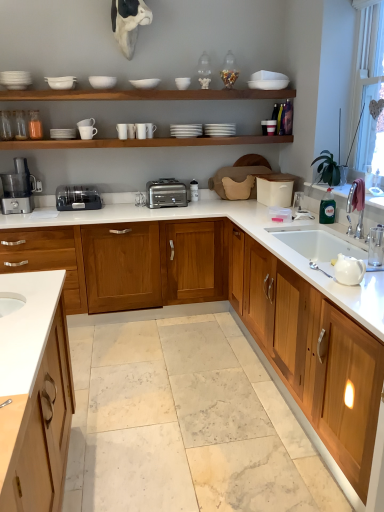
Question: In the image, is satin silver toaster at center, the 1th appliance when ordered from right to left, on the left side or the right side of satin silver toaster at center?

Choices:
 (A) right
 (B) left

Answer: (A)

Question: In the image, is satin silver toaster at center, which is the 2th appliance from front to back, positioned in front of or behind satin silver toaster at center?

Choices:
 (A) behind
 (B) front

Answer: (A)

Question: Which of these objects is positioned closest to the transparent plastic window screen at upper right?

Choices:
 (A) white glossy countertop at center, the second countertop from the bottom
 (B) wooden cabinet at right
 (C) satin silver toaster at center
 (D) satin silver toaster at center, the 1th appliance when ordered from right to left
 (E) white glossy teapot at right

Answer: (A)

Question: Which object is the closest to the satin silver toaster at center, the 1th appliance when ordered from right to left?

Choices:
 (A) satin silver toaster at center
 (B) satin black toaster at center, placed as the first appliance when sorted from front to back
 (C) white glossy teapot at right
 (D) white matte shelf at upper center
 (E) transparent plastic window screen at upper right

Answer: (A)